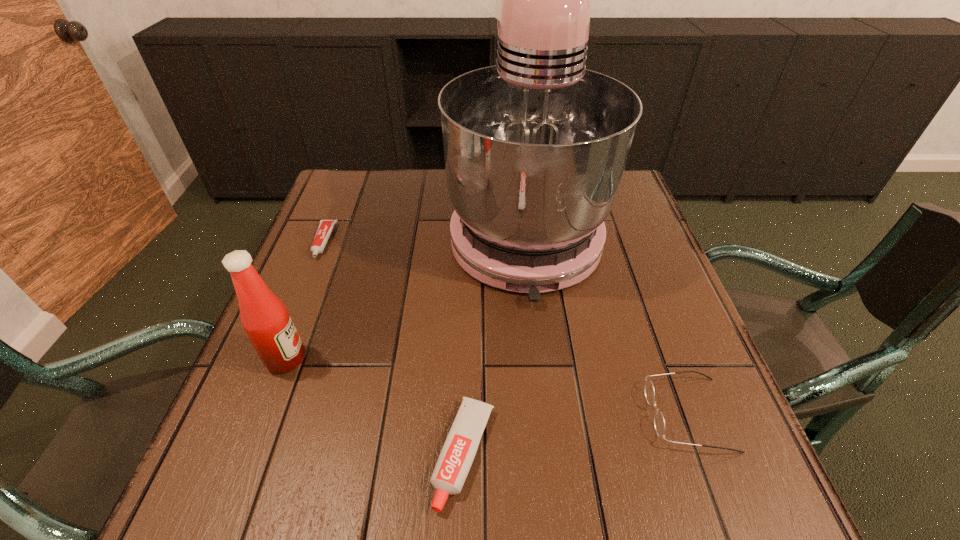
The width and height of the screenshot is (960, 540). I want to click on blank space located through the lenses of the spectacles, so click(x=485, y=414).

Where is `vacant point located through the lenses of the spectacles`? The image size is (960, 540). vacant point located through the lenses of the spectacles is located at coordinates click(x=581, y=414).

Where is `vacant space located through the lenses of the spectacles`? vacant space located through the lenses of the spectacles is located at coordinates (451, 414).

Image resolution: width=960 pixels, height=540 pixels. I want to click on free region located 0.180m on the left of the right toothpaste, so click(324, 454).

In order to click on free space located at the nozzle of the shorter toothpaste in this screenshot , I will do `click(281, 347)`.

Find the location of a particular element. This screenshot has width=960, height=540. object present at the far edge is located at coordinates (535, 147).

Locate an element on the screen. object that is at the near edge is located at coordinates (458, 452).

Find the location of a particular element. The width and height of the screenshot is (960, 540). condiment at the left edge is located at coordinates (265, 319).

The height and width of the screenshot is (540, 960). Find the location of `toothpaste present at the left edge`. toothpaste present at the left edge is located at coordinates (325, 228).

At what (x,y) coordinates should I click in order to perform the action: click on mixer that is at the right edge. Please return your answer as a coordinate pair (x, y). Image resolution: width=960 pixels, height=540 pixels. Looking at the image, I should click on (535, 147).